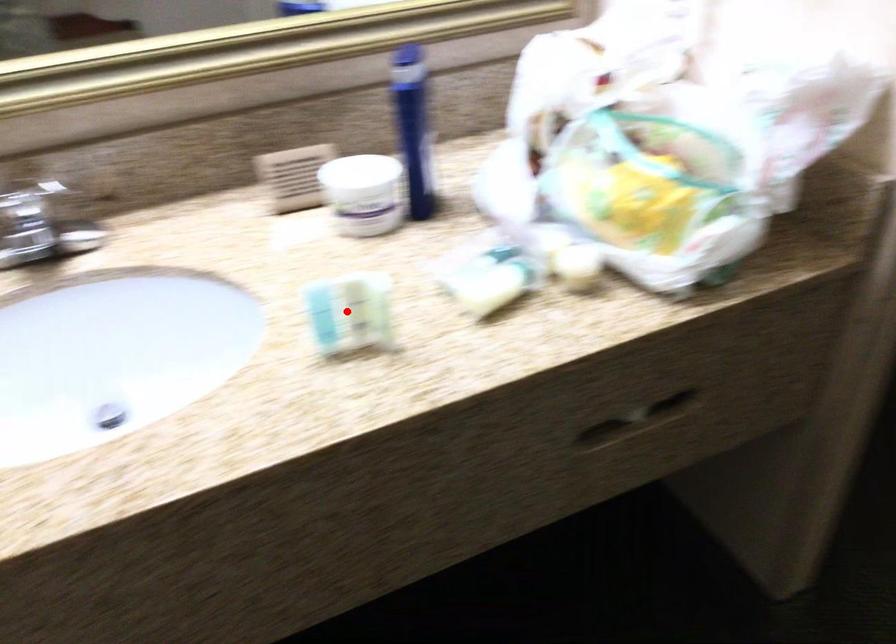
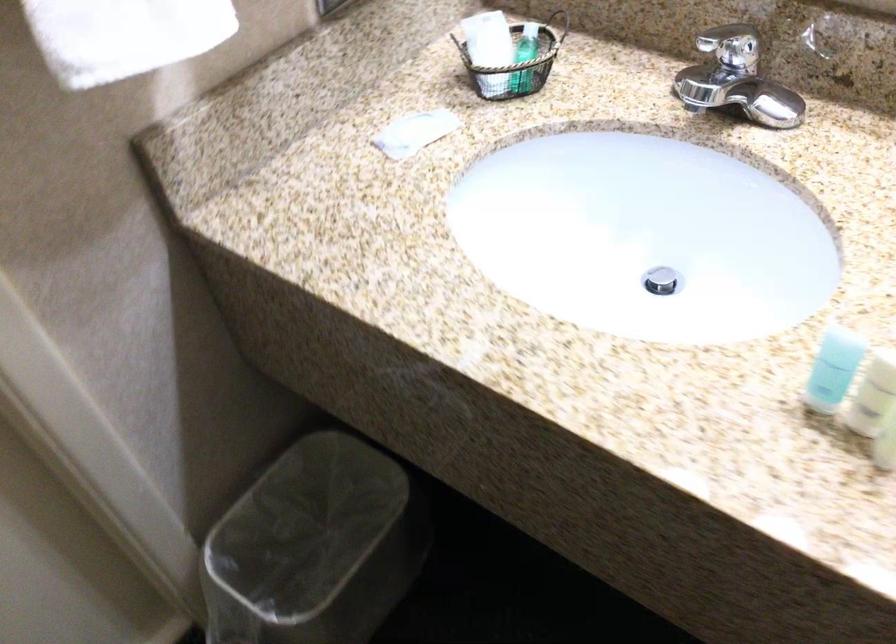
Question: I am providing you with two images of the same scene from different viewpoints. In image1, a red point is highlighted. Considering the same 3D point in image2, which of the following is correct?

Choices:
 (A) It is closer
 (B) It is farther

Answer: (A)